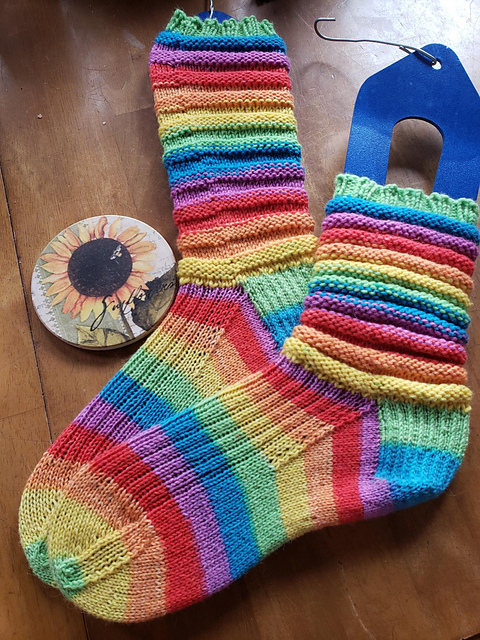
Where is `table top`? This screenshot has height=640, width=480. table top is located at coordinates (97, 153).